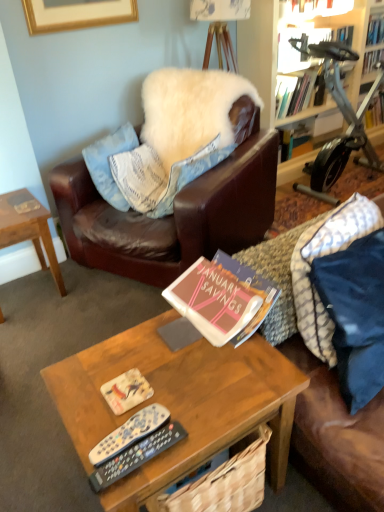
Where is `hardcover book at upper center, positioned as the 4th book in top-to-bottom order`? The image size is (384, 512). hardcover book at upper center, positioned as the 4th book in top-to-bottom order is located at coordinates (294, 93).

The height and width of the screenshot is (512, 384). Describe the element at coordinates (372, 60) in the screenshot. I see `hardcover book at upper right, which appears as the 2th book when viewed from the top` at that location.

Where is `woodenwoodencoffee table at center, positioned as the second coffee table in back-to-front order`? The width and height of the screenshot is (384, 512). woodenwoodencoffee table at center, positioned as the second coffee table in back-to-front order is located at coordinates (179, 402).

Identify the location of silver metallic stationary bicycle at upper right. This screenshot has width=384, height=512. (343, 116).

In order to face wooden coffee table at left, arranged as the 2th coffee table when viewed from the front, should I rotate leftwards or rightwards?

Rotate left and turn 22.561 degrees.

Image resolution: width=384 pixels, height=512 pixels. I want to click on white fluffy pillow at upper center, the 1th pillow in the back-to-front sequence, so click(x=189, y=109).

Does matte pink book at center, positioned as the 5th book in back-to-front order, have a greater width compared to matte paper book cover at center?

Yes, matte pink book at center, positioned as the 5th book in back-to-front order, is wider than matte paper book cover at center.

Does matte pink book at center, positioned as the first book in bottom-to-top order, have a smaller size compared to matte paper book cover at center?

Incorrect, matte pink book at center, positioned as the first book in bottom-to-top order, is not smaller in size than matte paper book cover at center.

Is matte paper book cover at center inside matte pink book at center, the fifth book positioned from the top?

No.

Which is behind, matte pink book at center, positioned as the first book in bottom-to-top order, or matte paper book cover at center?

matte pink book at center, positioned as the first book in bottom-to-top order, is further away from the camera.

From a real-world perspective, is matte paper book cover at center located beneath hardcover book at upper center, marked as the 2th book in a bottom-to-top arrangement?

Yes.

Is point (124, 384) closer or farther from the camera than point (286, 105)?

Point (124, 384) is closer to the camera than point (286, 105).

Based on the photo, is matte paper book cover at center looking in the opposite direction of hardcover book at upper center, marked as the 2th book in a bottom-to-top arrangement?

No, hardcover book at upper center, marked as the 2th book in a bottom-to-top arrangement, is not at the back of matte paper book cover at center.

Which is in front, matte paper book cover at center or hardcover book at upper center, which is counted as the 2th book, starting from the back?

matte paper book cover at center is closer to the camera.

Is wooden coffee table at left, arranged as the 2th coffee table when viewed from the front, placed right next to black plastic remote control at lower center, which is the first remote control from back to front?

No.

Is wooden coffee table at left, arranged as the 1th coffee table when viewed from the back, to the left or to the right of black plastic remote control at lower center, acting as the 2th remote control starting from the front, in the image?

wooden coffee table at left, arranged as the 1th coffee table when viewed from the back, is to the left of black plastic remote control at lower center, acting as the 2th remote control starting from the front.

From the image's perspective, is wooden coffee table at left, which is the first coffee table from left to right, located above black plastic remote control at lower center, which is the first remote control from back to front?

Yes, from the image's perspective, wooden coffee table at left, which is the first coffee table from left to right, is over black plastic remote control at lower center, which is the first remote control from back to front.

In the image, is black plastic remote at center, the first remote control viewed from the front, positioned in front of or behind black plastic remote control at lower center, which is the first remote control from back to front?

Clearly, black plastic remote at center, the first remote control viewed from the front, is in front of black plastic remote control at lower center, which is the first remote control from back to front.

Based on the photo, how many degrees apart are the facing directions of black plastic remote at center, the first remote control viewed from the front, and black plastic remote control at lower center, acting as the 2th remote control starting from the front?

7.92 degrees separate the facing orientations of black plastic remote at center, the first remote control viewed from the front, and black plastic remote control at lower center, acting as the 2th remote control starting from the front.

Is black plastic remote at center, which is the second remote control from back to front, smaller than black plastic remote control at lower center, which is the first remote control from back to front?

Indeed, black plastic remote at center, which is the second remote control from back to front, has a smaller size compared to black plastic remote control at lower center, which is the first remote control from back to front.

How many degrees apart are the facing directions of brown woven basket at center and hardcover book at upper center, positioned as the 4th book in top-to-bottom order?

They differ by 82.6 degrees in their facing directions.

From the image's perspective, relative to hardcover book at upper center, acting as the 4th book starting from the front, is brown woven basket at center above or below?

brown woven basket at center is below hardcover book at upper center, acting as the 4th book starting from the front.

In the scene shown: Considering the relative sizes of brown woven basket at center and hardcover book at upper center, which is counted as the 2th book, starting from the back, in the image provided, is brown woven basket at center smaller than hardcover book at upper center, which is counted as the 2th book, starting from the back,?

Yes.

Is brown woven basket at center to the left of hardcover book at upper center, positioned as the 4th book in top-to-bottom order, from the viewer's perspective?

Indeed, brown woven basket at center is positioned on the left side of hardcover book at upper center, positioned as the 4th book in top-to-bottom order.

Would you say hardcover book at upper center, acting as the fifth book starting from the bottom, is part of black plastic remote control at lower center, which is the first remote control from back to front,'s contents?

Actually, hardcover book at upper center, acting as the fifth book starting from the bottom, is outside black plastic remote control at lower center, which is the first remote control from back to front.

Which object is closer to the camera, black plastic remote control at lower center, which is the first remote control from back to front, or hardcover book at upper center, the fourth book viewed from the back?

black plastic remote control at lower center, which is the first remote control from back to front, is more forward.

Is point (118, 450) behind point (280, 8)?

No, (118, 450) is closer to viewer.

From a real-world perspective, is black plastic remote control at lower center, acting as the 2th remote control starting from the front, physically located above or below hardcover book at upper center, the 1th book viewed from the top?

black plastic remote control at lower center, acting as the 2th remote control starting from the front, is situated lower than hardcover book at upper center, the 1th book viewed from the top, in the real world.

Is blue fabric pillow at right, which is the 3th pillow from back to front, closer to camera compared to hardcover book at upper center, which is counted as the 2th book, starting from the front?

Yes, blue fabric pillow at right, which is the 3th pillow from back to front, is in front of hardcover book at upper center, which is counted as the 2th book, starting from the front.

Considering the sizes of blue fabric pillow at right, which is the 3th pillow from back to front, and hardcover book at upper center, which is counted as the 2th book, starting from the front, in the image, is blue fabric pillow at right, which is the 3th pillow from back to front, wider or thinner than hardcover book at upper center, which is counted as the 2th book, starting from the front,?

Considering their sizes, blue fabric pillow at right, which is the 3th pillow from back to front, looks broader than hardcover book at upper center, which is counted as the 2th book, starting from the front.

Is blue fabric pillow at right, the 1th pillow from the front, with hardcover book at upper center, which is counted as the 2th book, starting from the front?

No, blue fabric pillow at right, the 1th pillow from the front, is not with hardcover book at upper center, which is counted as the 2th book, starting from the front.

From the image's perspective, which one is positioned higher, blue fabric pillow at right, the 1th pillow from the front, or hardcover book at upper center, acting as the fifth book starting from the bottom?

hardcover book at upper center, acting as the fifth book starting from the bottom, from the image's perspective.

From a real-world perspective, starting from the matte paper book cover at center, which book is the 1st one vertically above it? Please provide its 2D coordinates.

[(219, 302)]

Which book is the 2nd one when counting from the right side of the matte paper book cover at center? Please provide its 2D coordinates.

[(294, 93)]

Looking at the image, which one is located closer to white fluffy pillow at upper center, the third pillow viewed from the front, woodenwoodencoffee table at center, positioned as the second coffee table in back-to-front order, or wooden coffee table at left, arranged as the 2th coffee table when viewed from the front?

Among the two, wooden coffee table at left, arranged as the 2th coffee table when viewed from the front, is located nearer to white fluffy pillow at upper center, the third pillow viewed from the front.

Based on their spatial positions, is hardcover book at upper center, acting as the fifth book starting from the bottom, or matte paper book cover at center further from white fluffy pillow at upper center, which ranks as the 2th pillow in back-to-front order?

The object further to white fluffy pillow at upper center, which ranks as the 2th pillow in back-to-front order, is hardcover book at upper center, acting as the fifth book starting from the bottom.

From the image, which object appears to be farther from matte pink book at center, positioned as the first book in bottom-to-top order, wooden coffee table at left, arranged as the 1th coffee table when viewed from the back, or white fluffy pillow at upper center, the third pillow viewed from the front?

Among the two, white fluffy pillow at upper center, the third pillow viewed from the front, is located further to matte pink book at center, positioned as the first book in bottom-to-top order.

When comparing their distances from hardcover book at upper right, which appears as the 4th book when ordered from the bottom, does wooden coffee table at left, arranged as the 2th coffee table when viewed from the front, or silver metallic stationary bicycle at upper right seem closer?

Among the two, silver metallic stationary bicycle at upper right is located nearer to hardcover book at upper right, which appears as the 4th book when ordered from the bottom.

From the image, which object appears to be farther from woodenwoodencoffee table at center, which ranks as the second coffee table in left-to-right order, hardcover book at upper right, marked as the first book in a back-to-front arrangement, or hardcover book at upper center, positioned as the 4th book in top-to-bottom order?

Based on the image, hardcover book at upper right, marked as the first book in a back-to-front arrangement, appears to be further to woodenwoodencoffee table at center, which ranks as the second coffee table in left-to-right order.

Based on their spatial positions, is silver metallic stationary bicycle at upper right or woodenwoodencoffee table at center, the first coffee table when ordered from front to back, further from black plastic remote control at lower center, acting as the 2th remote control starting from the front?

silver metallic stationary bicycle at upper right.

Looking at the image, which one is located further to brown woven basket at center, hardcover book at upper center, positioned as the 4th book in top-to-bottom order, or black plastic remote control at lower center, which is the first remote control from back to front?

Based on the image, hardcover book at upper center, positioned as the 4th book in top-to-bottom order, appears to be further to brown woven basket at center.

Which object lies further to the anchor point woodenwoodencoffee table at center, the first coffee table when ordered from front to back, hardcover book at upper center, the fourth book viewed from the back, or black plastic remote at center, which is the second remote control from back to front?

The object further to woodenwoodencoffee table at center, the first coffee table when ordered from front to back, is hardcover book at upper center, the fourth book viewed from the back.

Locate an element on the screen. This screenshot has height=512, width=384. stationary bicycle between blue fabric pillow at right, which is the 3th pillow from back to front, and hardcover book at upper right, which appears as the 4th book when ordered from the bottom, from front to back is located at coordinates (343, 116).

Locate an element on the screen. stationary bicycle between brown woven basket at center and hardcover book at upper right, which appears as the 4th book when ordered from the bottom, in the front-back direction is located at coordinates (343, 116).

Where is `book cover between woodenwoodencoffee table at center, the first coffee table when ordered from front to back, and hardcover book at upper center, which is counted as the 2th book, starting from the back, along the z-axis`? The image size is (384, 512). book cover between woodenwoodencoffee table at center, the first coffee table when ordered from front to back, and hardcover book at upper center, which is counted as the 2th book, starting from the back, along the z-axis is located at coordinates (126, 391).

Locate an element on the screen. The image size is (384, 512). pillow between blue fabric pillow at right, which is the 3th pillow from back to front, and white fluffy pillow at upper center, the 1th pillow in the back-to-front sequence, in the front-back direction is located at coordinates (189, 174).